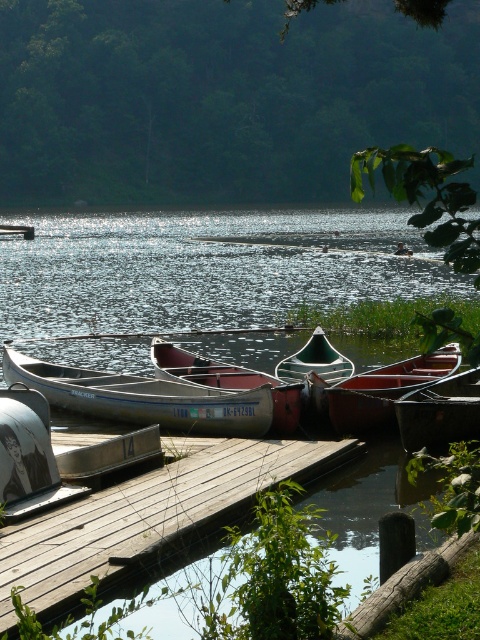
Question: Which point appears closest to the camera in this image?

Choices:
 (A) (127, 323)
 (B) (315, 348)
 (C) (237, 429)
 (D) (280, 387)

Answer: (C)

Question: Is white plastic canoe at center positioned before silver metallic canoe at center?

Choices:
 (A) yes
 (B) no

Answer: (A)

Question: Which object appears farthest from the camera in this image?

Choices:
 (A) wooden dock at center
 (B) silver metallic canoe at center
 (C) white plastic canoe at center

Answer: (B)

Question: Is wooden dock at center thinner than green matte canoe at center?

Choices:
 (A) no
 (B) yes

Answer: (A)

Question: From the image, what is the correct spatial relationship of silver metallic canoe at center in relation to green matte canoe at center?

Choices:
 (A) left
 (B) right

Answer: (A)

Question: Among these objects, which one is nearest to the camera?

Choices:
 (A) silver metallic canoe at center
 (B) glistening water at center

Answer: (A)